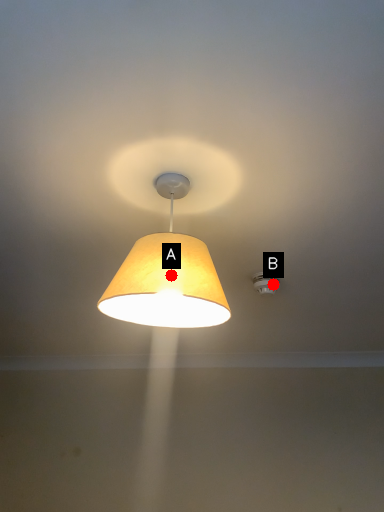
Question: Two points are circled on the image, labeled by A and B beside each circle. Which point is farther to the camera?

Choices:
 (A) A is further
 (B) B is further

Answer: (B)